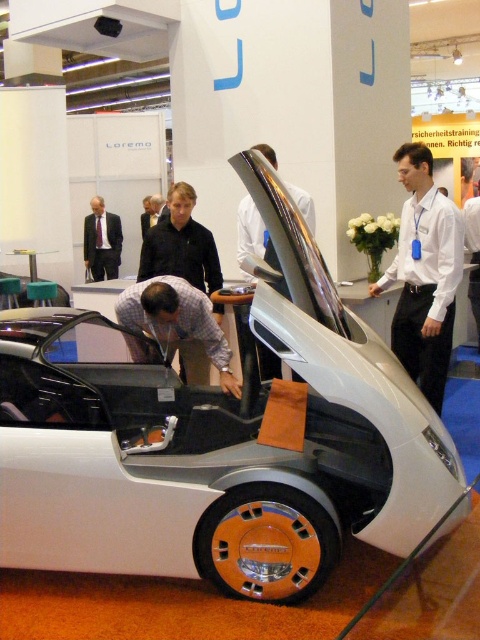
Question: Based on their relative distances, which object is farther from the white matte car at center?

Choices:
 (A) matte gray car at center
 (B) dark gray suit at left
 (C) glossy metallic car door at center

Answer: (B)

Question: Among these points, which one is farthest from the camera?

Choices:
 (A) pyautogui.click(x=405, y=356)
 (B) pyautogui.click(x=48, y=429)

Answer: (A)

Question: Is white matte car at center closer to camera compared to dark gray suit at left?

Choices:
 (A) no
 (B) yes

Answer: (B)

Question: Does glossy metallic car door at center have a lesser width compared to dark gray suit at left?

Choices:
 (A) no
 (B) yes

Answer: (B)

Question: Observing the image, what is the correct spatial positioning of glossy metallic car door at center in reference to dark gray suit at left?

Choices:
 (A) above
 (B) below

Answer: (B)

Question: Which object appears closest to the camera in this image?

Choices:
 (A) white shirt at right
 (B) white matte car at center

Answer: (B)